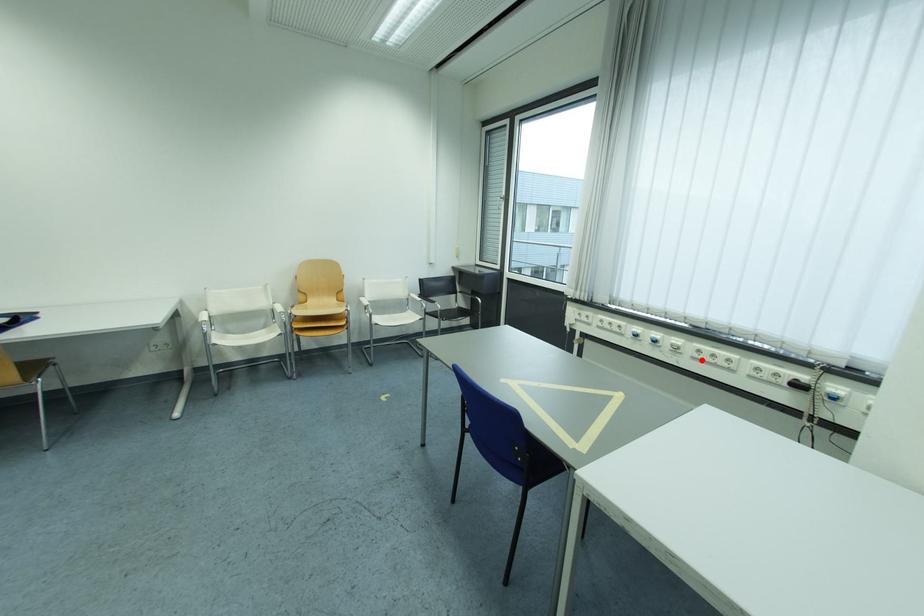
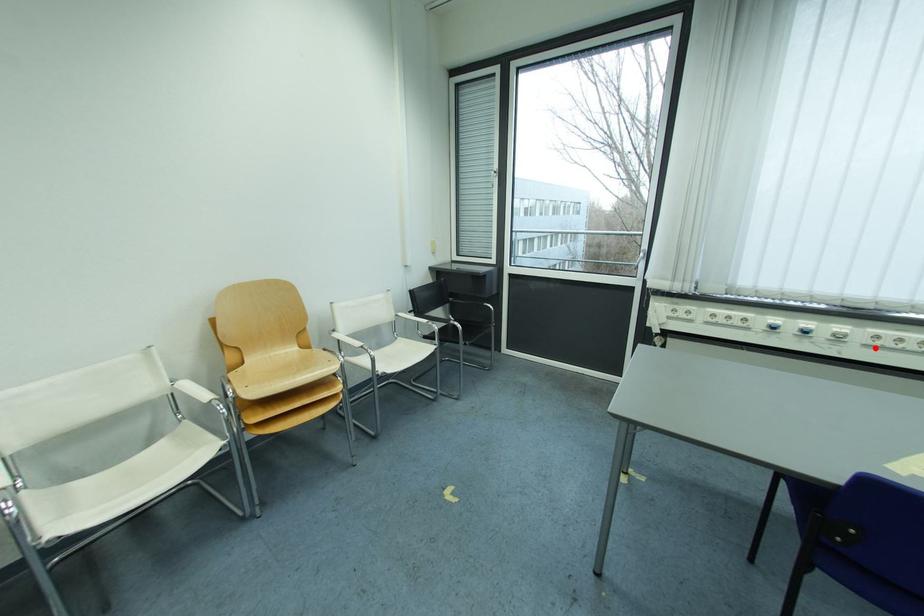
I am providing you with two images of the same scene from different viewpoints. A red point is marked on the first image and another point is marked on the second image. Do the highlighted points in image1 and image2 indicate the same real-world spot?

Yes